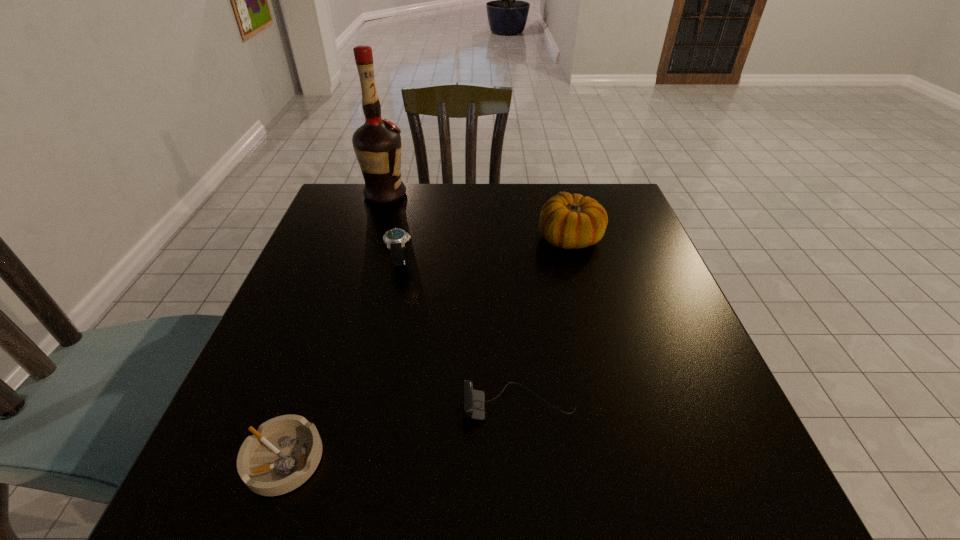
The image size is (960, 540). Identify the location of object at the near left corner. (284, 452).

Where is `object at the far right corner`? This screenshot has width=960, height=540. object at the far right corner is located at coordinates click(568, 221).

Where is `free location at the far edge`? The width and height of the screenshot is (960, 540). free location at the far edge is located at coordinates (552, 187).

This screenshot has height=540, width=960. I want to click on vacant area at the near edge of the desktop, so click(349, 498).

In the image, there is a desktop. Where is `vacant space at the right edge`? vacant space at the right edge is located at coordinates (749, 442).

In the image, there is a desktop. Where is `vacant space at the far right corner`? vacant space at the far right corner is located at coordinates (634, 215).

Identify the location of empty location between the second tallest object and the ashtray. This screenshot has width=960, height=540. (427, 348).

Find the location of a particular element. This screenshot has width=960, height=540. free spot between the gourd and the ashtray is located at coordinates (427, 348).

Locate an element on the screen. vacant area that lies between the gourd and the farthest object is located at coordinates (477, 216).

Locate an element on the screen. free space between the watch and the webcam is located at coordinates (460, 333).